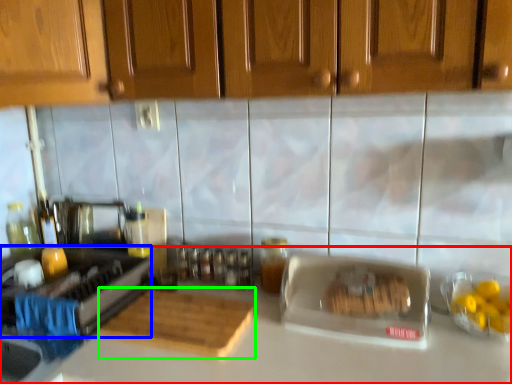
Question: Based on their relative distances, which object is nearer to countertop (highlighted by a red box)? Choose from appliance (highlighted by a blue box) and cutting board (highlighted by a green box).

Choices:
 (A) appliance
 (B) cutting board

Answer: (B)